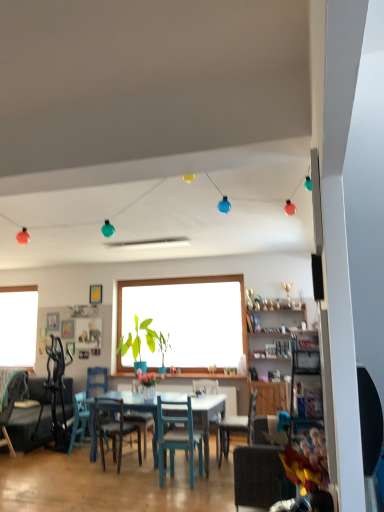
I want to click on wooden cabinet at center, so click(x=272, y=360).

In order to face wooden cabinet at center, should I rotate leftwards or rightwards?

Rotate your view right by about 11.600°.

Image resolution: width=384 pixels, height=512 pixels. Identify the location of velvet teal chair at lower right, arranged as the 1th chair when viewed from the right. (260, 472).

Measure the distance between point (52, 323) and camera.

6.84 meters.

Identify the location of wooden picture frame at upper center, the 3th picture frame when ordered from bottom to top. (95, 294).

Where is `teal wood chair at center, the fourth chair from the left`? The height and width of the screenshot is (512, 384). teal wood chair at center, the fourth chair from the left is located at coordinates (177, 436).

From the image's perspective, is wooden picture frame at left, which is the third picture frame from right to left, on top of dark gray fabric couch at lower left?

Yes, from the image's perspective, wooden picture frame at left, which is the third picture frame from right to left, is above dark gray fabric couch at lower left.

Relative to dark gray fabric couch at lower left, is wooden picture frame at left, the 2th picture frame from the top, in front or behind?

In the image, wooden picture frame at left, the 2th picture frame from the top, appears behind dark gray fabric couch at lower left.

Which object is wider, wooden picture frame at left, the 2th picture frame from the top, or dark gray fabric couch at lower left?

Wider between the two is dark gray fabric couch at lower left.

From a real-world perspective, starting from the dark gray fabric couch at lower left, which picture frame is the 2nd one vertically above it? Please provide its 2D coordinates.

[(53, 321)]

Can you confirm if dark gray fabric couch at lower left is thinner than velvet teal chair at lower right, arranged as the 6th chair when viewed from the left?

No.

Is point (22, 426) less distant than point (261, 441)?

No.

Consider the image. Is dark gray fabric couch at lower left placed right next to velvet teal chair at lower right, arranged as the 6th chair when viewed from the left?

No, dark gray fabric couch at lower left is not with velvet teal chair at lower right, arranged as the 6th chair when viewed from the left.

Consider the image. Is dark gray fabric couch at lower left positioned with its back to velvet teal chair at lower right, arranged as the 1th chair when viewed from the right?

No, dark gray fabric couch at lower left is not facing away from velvet teal chair at lower right, arranged as the 1th chair when viewed from the right.

Which of these two, wooden picture frame at left, acting as the first picture frame starting from the left, or teal wood chair at lower left, the 5th chair when ordered from right to left, is thinner?

wooden picture frame at left, acting as the first picture frame starting from the left, is thinner.

In the scene shown: From the image's perspective, does wooden picture frame at left, which is the third picture frame from right to left, appear higher than teal wood chair at lower left, positioned as the 2th chair in left-to-right order?

Yes, from the image's perspective, wooden picture frame at left, which is the third picture frame from right to left, is on top of teal wood chair at lower left, positioned as the 2th chair in left-to-right order.

Based on the photo, measure the distance between wooden picture frame at left, acting as the first picture frame starting from the left, and teal wood chair at lower left, positioned as the 2th chair in left-to-right order.

A distance of 4.75 feet exists between wooden picture frame at left, acting as the first picture frame starting from the left, and teal wood chair at lower left, positioned as the 2th chair in left-to-right order.

Is wooden picture frame at left, which is counted as the second picture frame, starting from the bottom, bigger or smaller than teal wood chair at lower left, positioned as the 2th chair in left-to-right order?

Considering their sizes, wooden picture frame at left, which is counted as the second picture frame, starting from the bottom, takes up less space than teal wood chair at lower left, positioned as the 2th chair in left-to-right order.

From a real-world perspective, is matte teal chair at center, which ranks as the 5th chair in left-to-right order, on teal wood chair at lower left, the 5th chair when ordered from right to left?

Yes.

Is matte teal chair at center, the 2th chair from the right, next to teal wood chair at lower left, positioned as the 2th chair in left-to-right order?

No.

Which chair is the 2nd one when counting from the front of the teal wood chair at lower left, the 5th chair when ordered from right to left? Please provide its 2D coordinates.

[(237, 426)]

In terms of size, does matte teal chair at center, the 2th chair from the right, appear bigger or smaller than teal wood chair at lower left, the 5th chair when ordered from right to left?

In the image, matte teal chair at center, the 2th chair from the right, appears to be larger than teal wood chair at lower left, the 5th chair when ordered from right to left.

Is point (100, 285) closer to camera compared to point (156, 337)?

No.

Locate an element on the screen. The height and width of the screenshot is (512, 384). houseplant on the right of wooden picture frame at upper center, the 3th picture frame when ordered from bottom to top is located at coordinates (138, 343).

Are wooden picture frame at upper center, marked as the 3th picture frame in a left-to-right arrangement, and green matte plant at center beside each other?

wooden picture frame at upper center, marked as the 3th picture frame in a left-to-right arrangement, and green matte plant at center are clearly separated.

Is velvet teal chair at lower right, arranged as the 6th chair when viewed from the left, to the left or to the right of dark gray fabric couch at lower left in the image?

Clearly, velvet teal chair at lower right, arranged as the 6th chair when viewed from the left, is on the right of dark gray fabric couch at lower left in the image.

Looking at this image, from a real-world perspective, between velvet teal chair at lower right, arranged as the 1th chair when viewed from the right, and dark gray fabric couch at lower left, who is vertically lower?

In real-world perspective, velvet teal chair at lower right, arranged as the 1th chair when viewed from the right, is lower.

Is velvet teal chair at lower right, arranged as the 6th chair when viewed from the left, positioned with its back to dark gray fabric couch at lower left?

No, velvet teal chair at lower right, arranged as the 6th chair when viewed from the left, is not facing the opposite direction of dark gray fabric couch at lower left.

Can you confirm if velvet teal chair at lower right, arranged as the 1th chair when viewed from the right, is wider than dark gray fabric couch at lower left?

No, velvet teal chair at lower right, arranged as the 1th chair when viewed from the right, is not wider than dark gray fabric couch at lower left.

Is teal fabric chair at lower left, marked as the 6th chair in a right-to-left arrangement, inside or outside of teal wood chair at lower left, positioned as the 2th chair in left-to-right order?

teal fabric chair at lower left, marked as the 6th chair in a right-to-left arrangement, is outside teal wood chair at lower left, positioned as the 2th chair in left-to-right order.

Could you tell me if teal fabric chair at lower left, which ranks as the 1th chair in left-to-right order, is facing teal wood chair at lower left, positioned as the 2th chair in left-to-right order?

No, teal fabric chair at lower left, which ranks as the 1th chair in left-to-right order, is not oriented towards teal wood chair at lower left, positioned as the 2th chair in left-to-right order.

Measure the distance from teal fabric chair at lower left, which ranks as the 1th chair in left-to-right order, to teal wood chair at lower left, positioned as the 2th chair in left-to-right order.

teal fabric chair at lower left, which ranks as the 1th chair in left-to-right order, and teal wood chair at lower left, positioned as the 2th chair in left-to-right order, are 83.39 centimeters apart.

Which object is closer to the camera taking this photo, teal fabric chair at lower left, which ranks as the 1th chair in left-to-right order, or teal wood chair at lower left, positioned as the 2th chair in left-to-right order?

teal fabric chair at lower left, which ranks as the 1th chair in left-to-right order, is in front.

Identify the location of studio couch lying in front of the wooden picture frame at left, acting as the first picture frame starting from the left. This screenshot has width=384, height=512. (31, 419).

Locate an element on the screen. Image resolution: width=384 pixels, height=512 pixels. the 3rd chair below the dark gray fabric couch at lower left (from a real-world perspective) is located at coordinates (260, 472).

In the scene shown: Based on their spatial positions, is wooden cabinet at center or black matte speaker at right closer to velvet teal chair at lower right, arranged as the 6th chair when viewed from the left?

wooden cabinet at center is positioned closer to the anchor velvet teal chair at lower right, arranged as the 6th chair when viewed from the left.

When comparing their distances from teal wood chair at center, the fourth chair from the left, does wooden chair at center, the 4th chair positioned from the right, or matte teal chair at center, the 2th chair from the right, seem closer?

matte teal chair at center, the 2th chair from the right, is positioned closer to the anchor teal wood chair at center, the fourth chair from the left.

Based on their spatial positions, is dark gray fabric couch at lower left or black matte speaker at right further from teal wood chair at lower left, the 5th chair when ordered from right to left?

The object further to teal wood chair at lower left, the 5th chair when ordered from right to left, is black matte speaker at right.

From the image, which object appears to be farther from teal fabric chair at lower left, marked as the 6th chair in a right-to-left arrangement, wooden picture frame at left, acting as the first picture frame starting from the left, or black matte speaker at right?

black matte speaker at right.

When comparing their distances from wooden picture frame at left, which is the third picture frame from right to left, does dark gray fabric couch at lower left or teal fabric chair at lower left, marked as the 6th chair in a right-to-left arrangement, seem further?

The object further to wooden picture frame at left, which is the third picture frame from right to left, is dark gray fabric couch at lower left.

Looking at the image, which one is located closer to black matte speaker at right, teal wood chair at lower left, the 5th chair when ordered from right to left, or matte teal chair at center, which ranks as the 5th chair in left-to-right order?

matte teal chair at center, which ranks as the 5th chair in left-to-right order.

Estimate the real-world distances between objects in this image. Which object is closer to green matte plant at center, dark gray fabric couch at lower left or wooden chair at center, the 4th chair positioned from the right?

wooden chair at center, the 4th chair positioned from the right, is positioned closer to the anchor green matte plant at center.

Which object lies nearer to the anchor point wooden picture frame at left, the 2th picture frame from the top, teal wood chair at lower left, positioned as the 2th chair in left-to-right order, or black matte speaker at right?

Based on the image, teal wood chair at lower left, positioned as the 2th chair in left-to-right order, appears to be nearer to wooden picture frame at left, the 2th picture frame from the top.

In order to click on cabinetry located between black matte speaker at right and wooden picture frame at left, the 2th picture frame from the top, in the depth direction in this screenshot , I will do `click(272, 360)`.

Locate an element on the screen. studio couch between teal fabric chair at lower left, marked as the 6th chair in a right-to-left arrangement, and wooden chair at center, which is the 3th chair from left to right, in the horizontal direction is located at coordinates (31, 419).

Find the location of a particular element. Image resolution: width=384 pixels, height=512 pixels. cabinetry between black matte speaker at right and wooden picture frame at center, the second picture frame viewed from the right, in the front-back direction is located at coordinates (272, 360).

In order to click on houseplant positioned between black matte speaker at right and wooden picture frame at center, acting as the 1th picture frame starting from the bottom, from near to far in this screenshot , I will do `click(138, 343)`.